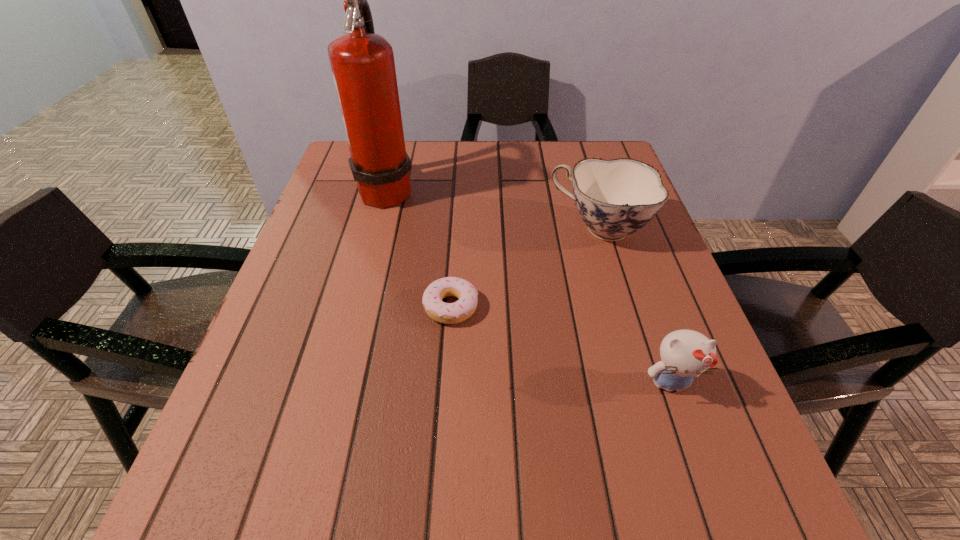
Locate an element on the screen. the tallest object is located at coordinates (362, 62).

Locate an element on the screen. Image resolution: width=960 pixels, height=540 pixels. the leftmost object is located at coordinates (362, 62).

Identify the location of chinaware. The width and height of the screenshot is (960, 540). (615, 198).

Locate an element on the screen. the nearest object is located at coordinates (685, 354).

This screenshot has width=960, height=540. Find the location of `the third object from right to left`. the third object from right to left is located at coordinates (447, 313).

Identify the location of the third farthest object. (447, 313).

You are a GUI agent. You are given a task and a screenshot of the screen. Output one action in this format:
    pyautogui.click(x=<x>, y=<y>)
    Task: Click on the blank space located 0.340m at the nozzle of the fire extinguisher
    Image resolution: width=960 pixels, height=540 pixels.
    Given the screenshot: What is the action you would take?
    pyautogui.click(x=541, y=190)

Locate an element on the screen. The width and height of the screenshot is (960, 540). vacant position located 0.280m on the front of the chinaware is located at coordinates (640, 361).

The width and height of the screenshot is (960, 540). Find the location of `free space located 0.120m on the front-facing side of the kitten`. free space located 0.120m on the front-facing side of the kitten is located at coordinates (702, 476).

Locate an element on the screen. This screenshot has width=960, height=540. free location located on the back of the doughnut is located at coordinates (454, 253).